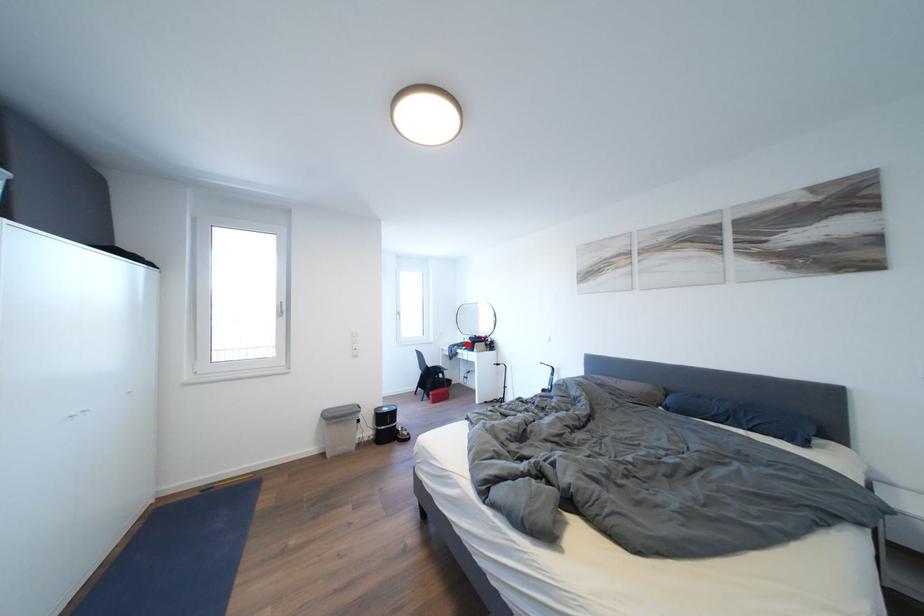
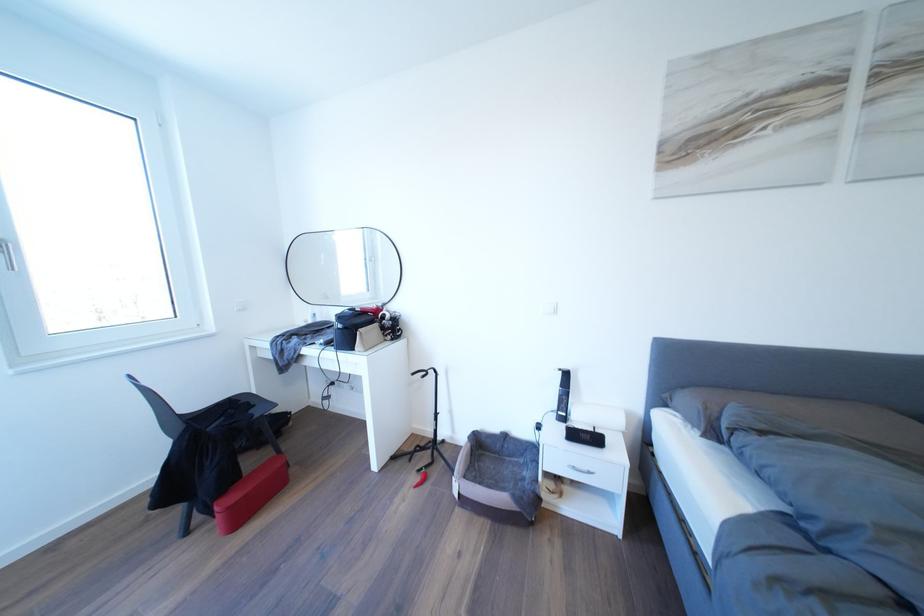
Question: I am providing you with two images of the same scene from different viewpoints. A red point is marked on the first image. At the location where the point appears in image 1, is it still visible in image 2?

Choices:
 (A) Yes
 (B) No

Answer: (A)